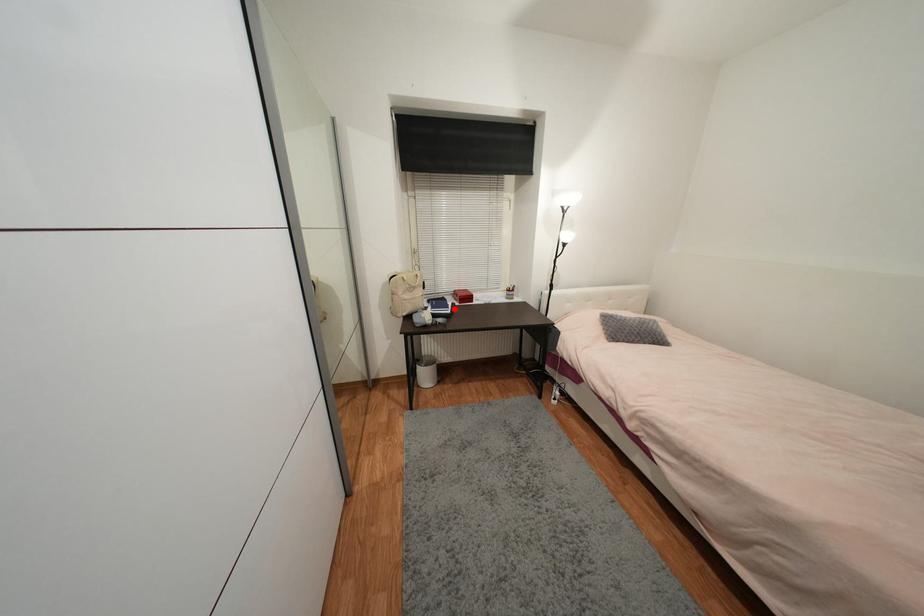
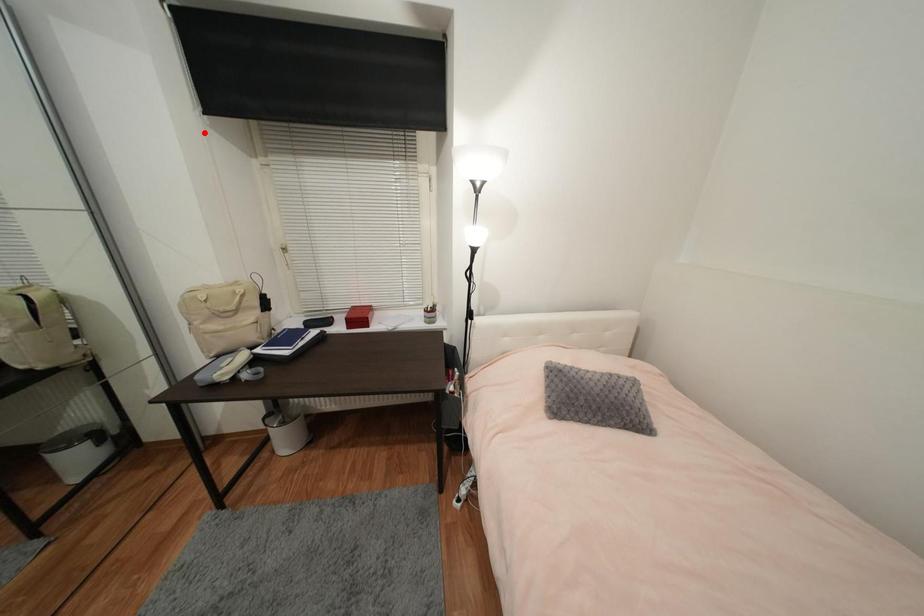
I am providing you with two images of the same scene from different viewpoints. A red point is marked on the first image and another point is marked on the second image. Do the highlighted points in image1 and image2 indicate the same real-world spot?

No